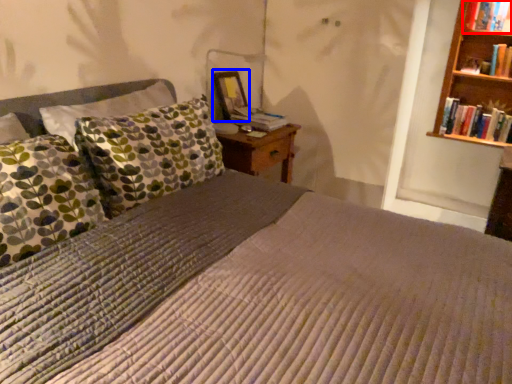
Question: Which object appears closest to the camera in this image, book (highlighted by a red box) or picture frame (highlighted by a blue box)?

Choices:
 (A) book
 (B) picture frame

Answer: (A)